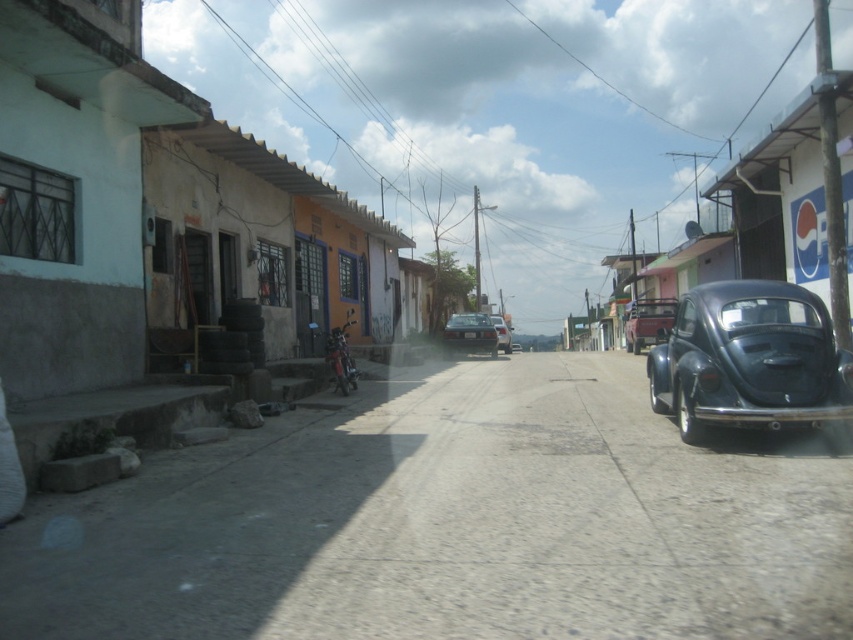
Is metallic blue car at center-right bigger than metallic silver sedan at center?

Yes.

Between metallic blue car at center-right and metallic silver sedan at center, which one is positioned lower?

Positioned lower is metallic silver sedan at center.

Measure the distance between metallic blue car at center-right and camera.

metallic blue car at center-right is 25.96 meters from camera.

Image resolution: width=853 pixels, height=640 pixels. Find the location of `metallic blue car at center-right`. metallic blue car at center-right is located at coordinates (648, 323).

The width and height of the screenshot is (853, 640). Describe the element at coordinates (469, 333) in the screenshot. I see `metallic silver sedan at center` at that location.

Can you confirm if metallic silver sedan at center is positioned below shiny red motorcycle at center?

Incorrect, metallic silver sedan at center is not positioned below shiny red motorcycle at center.

What do you see at coordinates (469, 333) in the screenshot?
I see `metallic silver sedan at center` at bounding box center [469, 333].

Where is `metallic silver sedan at center`? The height and width of the screenshot is (640, 853). metallic silver sedan at center is located at coordinates (469, 333).

Can you confirm if glossy dark blue car at right is wider than metallic blue car at center-right?

Yes.

Which is behind, point (839, 416) or point (636, 304)?

Positioned behind is point (636, 304).

Locate an element on the screen. The height and width of the screenshot is (640, 853). glossy dark blue car at right is located at coordinates (x=749, y=358).